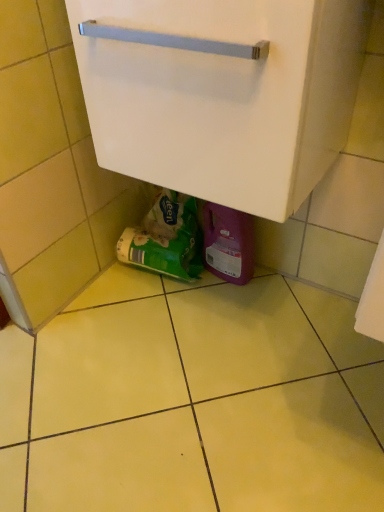
Question: Does green matte plastic bag at lower center have a lesser width compared to white matte cabinet at center?

Choices:
 (A) no
 (B) yes

Answer: (B)

Question: Is the position of green matte plastic bag at lower center less distant than that of white matte cabinet at center?

Choices:
 (A) yes
 (B) no

Answer: (B)

Question: Is green matte plastic bag at lower center to the right of white matte cabinet at center from the viewer's perspective?

Choices:
 (A) no
 (B) yes

Answer: (A)

Question: Is green matte plastic bag at lower center far from white matte cabinet at center?

Choices:
 (A) no
 (B) yes

Answer: (A)

Question: Considering the relative sizes of green matte plastic bag at lower center and white matte cabinet at center in the image provided, is green matte plastic bag at lower center wider than white matte cabinet at center?

Choices:
 (A) yes
 (B) no

Answer: (B)

Question: Is green matte plastic bag at lower center bigger than white matte cabinet at center?

Choices:
 (A) yes
 (B) no

Answer: (B)

Question: Does white matte cabinet at center appear on the right side of green matte plastic bag at lower center?

Choices:
 (A) no
 (B) yes

Answer: (B)

Question: Does white matte cabinet at center have a smaller size compared to green matte plastic bag at lower center?

Choices:
 (A) yes
 (B) no

Answer: (B)

Question: From the image's perspective, does white matte cabinet at center appear lower than green matte plastic bag at lower center?

Choices:
 (A) no
 (B) yes

Answer: (A)

Question: From a real-world perspective, is white matte cabinet at center over green matte plastic bag at lower center?

Choices:
 (A) no
 (B) yes

Answer: (B)

Question: Considering the relative sizes of white matte cabinet at center and green matte plastic bag at lower center in the image provided, is white matte cabinet at center bigger than green matte plastic bag at lower center?

Choices:
 (A) no
 (B) yes

Answer: (B)

Question: Considering the relative sizes of white matte cabinet at center and green matte plastic bag at lower center in the image provided, is white matte cabinet at center thinner than green matte plastic bag at lower center?

Choices:
 (A) no
 (B) yes

Answer: (A)

Question: In terms of width, does white matte cabinet at center look wider or thinner when compared to green matte plastic bag at lower center?

Choices:
 (A) thin
 (B) wide

Answer: (B)